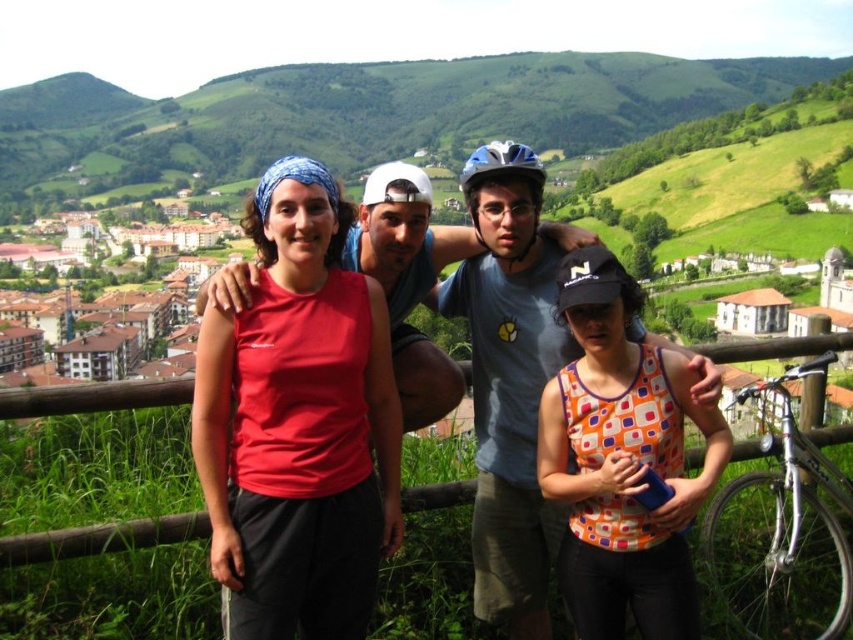
Who is higher up, matte red tank top at center or blue matte bicycle helmet at center?

Positioned higher is blue matte bicycle helmet at center.

Does point (351, 276) come farther from viewer compared to point (473, 214)?

No, (351, 276) is in front of (473, 214).

Does point (297, 358) come farther from viewer compared to point (479, 232)?

No, (297, 358) is closer to viewer.

Locate an element on the screen. matte red tank top at center is located at coordinates tap(299, 424).

Is matte red tank top at center below orange printed tank top at center?

No.

Can you confirm if matte red tank top at center is shorter than orange printed tank top at center?

No.

Is point (225, 634) less distant than point (582, 464)?

Yes, point (225, 634) is in front of point (582, 464).

Find the location of `matte red tank top at center`. matte red tank top at center is located at coordinates (299, 424).

Does orange printed tank top at center appear under silver metallic helmet at center?

Yes.

Does orange printed tank top at center appear over silver metallic helmet at center?

Incorrect, orange printed tank top at center is not positioned above silver metallic helmet at center.

What are the coordinates of `orange printed tank top at center` in the screenshot? It's located at (622, 460).